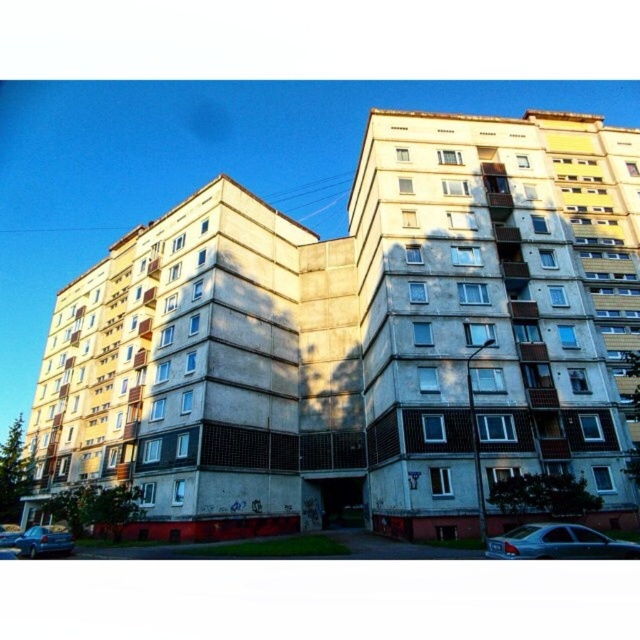
In the scene shown: You are a delivery driver who needs to park your vehicle in the parking lot near the residential building. You see a metallic silver sedan at lower right and a silver metallic sedan at lower left. Which sedan should you park behind to avoid blocking the other vehicles?

You should park behind the silver metallic sedan at lower left because the metallic silver sedan at lower right is already in front of it, meaning the silver metallic sedan at lower left is further back.

You are a delivery person standing at the entrance of the residential building. You need to park your metallic silver sedan at lower right as close as possible to the entrance without blocking the pathway. The entrance is at the lower left corner of the building. Can you park your car there?

The metallic silver sedan at lower right is 90.98 feet away from the camera, so it is too far to park close to the entrance without blocking the pathway.

You are a delivery driver who needs to park your van between the metallic silver sedan at lower right and the silver metallic sedan at lower left. Can you fit your van, which is 2 meters wide, in the available space between them?

The metallic silver sedan at lower right occupies less space than the silver metallic sedan at lower left, so the space between them is sufficient to accommodate a 2 meter wide van.